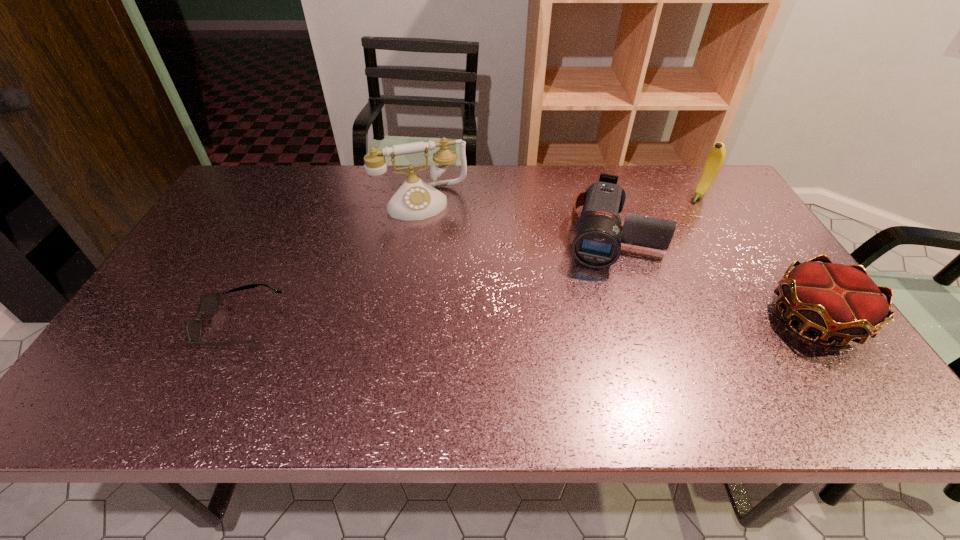
The width and height of the screenshot is (960, 540). In order to click on blank space located 0.050m on the dial of the telephone in this screenshot , I will do `click(435, 230)`.

Locate an element on the screen. free space located 0.390m on the dial of the telephone is located at coordinates [466, 316].

Where is `vacant space situated 0.090m from the stem of the banana`? The image size is (960, 540). vacant space situated 0.090m from the stem of the banana is located at coordinates (684, 216).

Image resolution: width=960 pixels, height=540 pixels. I want to click on vacant position located from the stem of the banana, so click(661, 244).

Find the location of a particular element. vacant area located 0.170m from the stem of the banana is located at coordinates (674, 228).

Identify the location of vacant space located 0.170m on the lens of the camcorder. The height and width of the screenshot is (540, 960). (597, 319).

The width and height of the screenshot is (960, 540). Find the location of `vacant space located on the lens of the camcorder`. vacant space located on the lens of the camcorder is located at coordinates (595, 328).

Find the location of a particular element. The height and width of the screenshot is (540, 960). vacant space located 0.290m on the lens of the camcorder is located at coordinates (590, 359).

The width and height of the screenshot is (960, 540). Find the location of `telephone that is at the far edge`. telephone that is at the far edge is located at coordinates (415, 199).

Image resolution: width=960 pixels, height=540 pixels. Find the location of `banana at the far edge`. banana at the far edge is located at coordinates (715, 158).